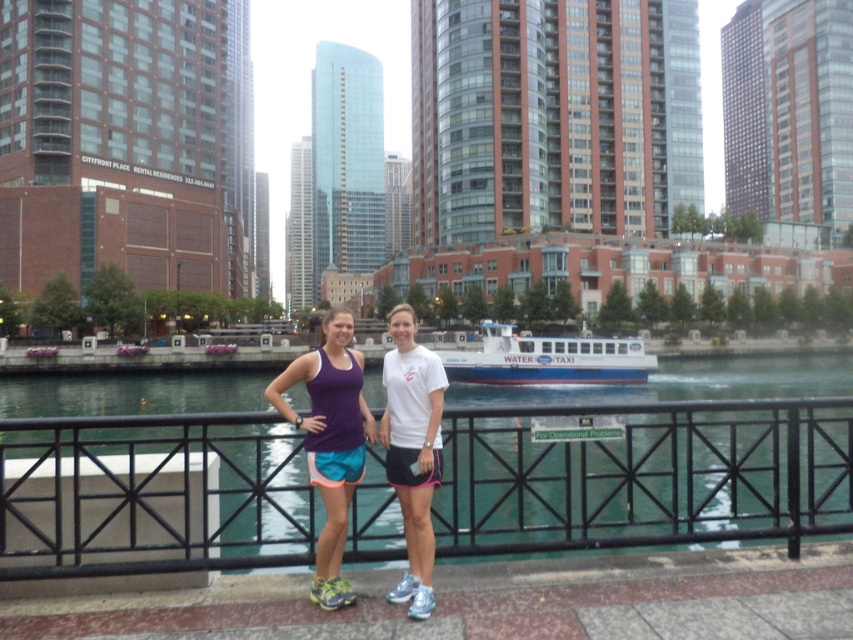
Is black metal railing at center to the right of white matte water taxi at center from the viewer's perspective?

Incorrect, black metal railing at center is not on the right side of white matte water taxi at center.

Does black metal railing at center have a lesser width compared to white matte water taxi at center?

In fact, black metal railing at center might be wider than white matte water taxi at center.

Where is `black metal railing at center`? The height and width of the screenshot is (640, 853). black metal railing at center is located at coordinates [646, 476].

Which is behind, point (442, 502) or point (422, 589)?

Positioned behind is point (442, 502).

Can you confirm if black metal railing at center is smaller than white matte t-shirt at center?

Incorrect, black metal railing at center is not smaller in size than white matte t-shirt at center.

The image size is (853, 640). In order to click on black metal railing at center in this screenshot , I will do `click(646, 476)`.

Is black metal railing at center bigger than purple fabric tank top at center?

Correct, black metal railing at center is larger in size than purple fabric tank top at center.

Describe the element at coordinates (646, 476) in the screenshot. The height and width of the screenshot is (640, 853). I see `black metal railing at center` at that location.

Where is `black metal railing at center`? The width and height of the screenshot is (853, 640). black metal railing at center is located at coordinates (646, 476).